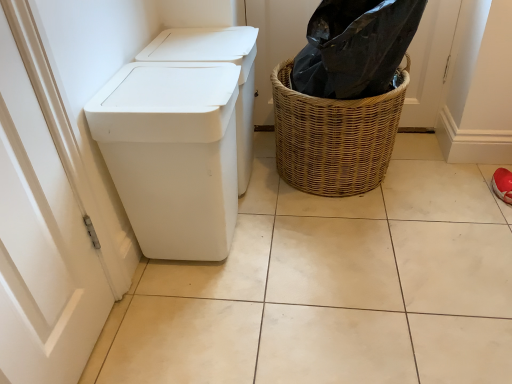
Find the location of `free spot to the right of woven brown basket at right`. free spot to the right of woven brown basket at right is located at coordinates (438, 183).